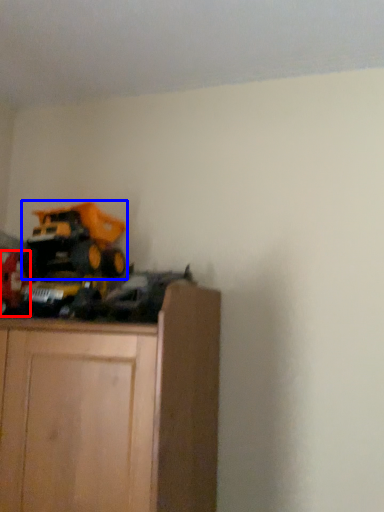
Question: Which point is further to the camera, toy (highlighted by a red box) or equipment (highlighted by a blue box)?

Choices:
 (A) toy
 (B) equipment

Answer: (B)